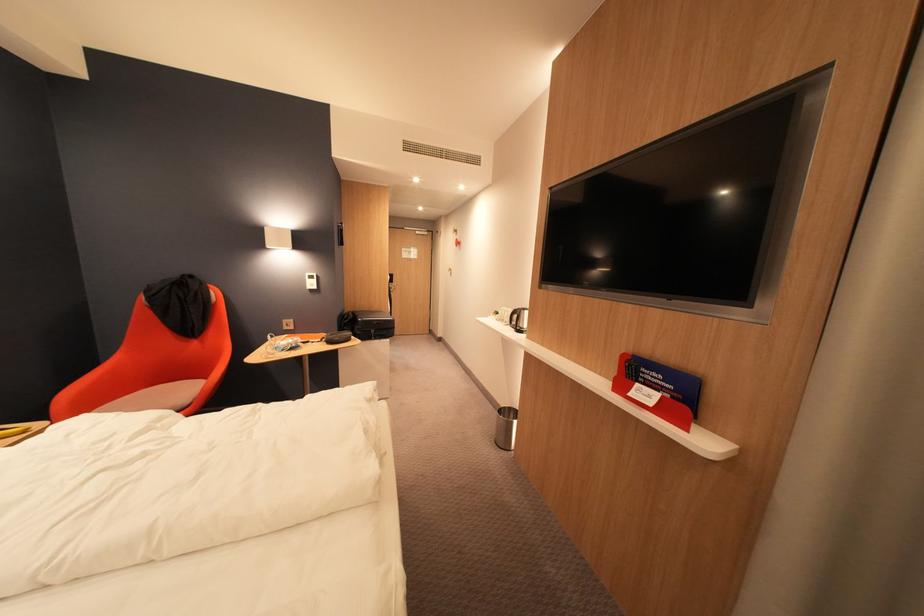
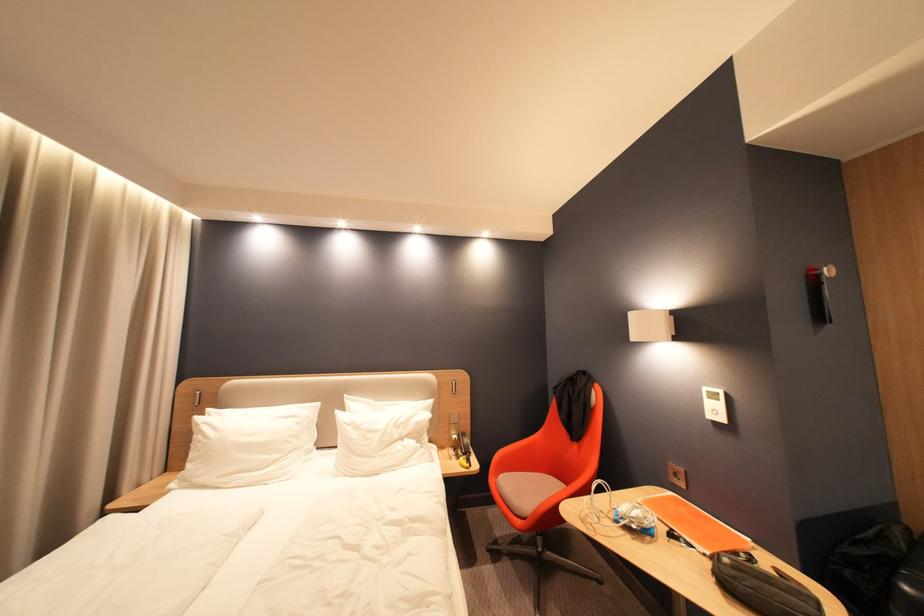
The point at (351, 225) is marked in the first image. Where is the corresponding point in the second image?

(830, 270)